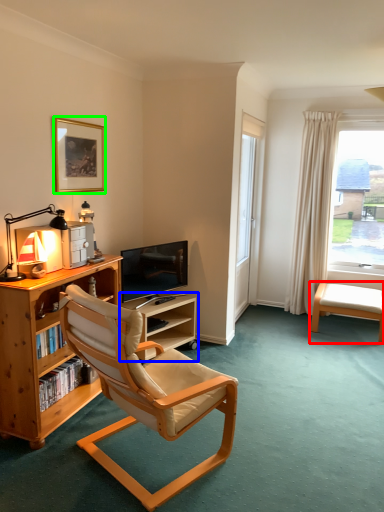
Question: Which is nearer to the swivel chair (highlighted by a red box)? shelf (highlighted by a blue box) or picture frame (highlighted by a green box).

Choices:
 (A) shelf
 (B) picture frame

Answer: (A)